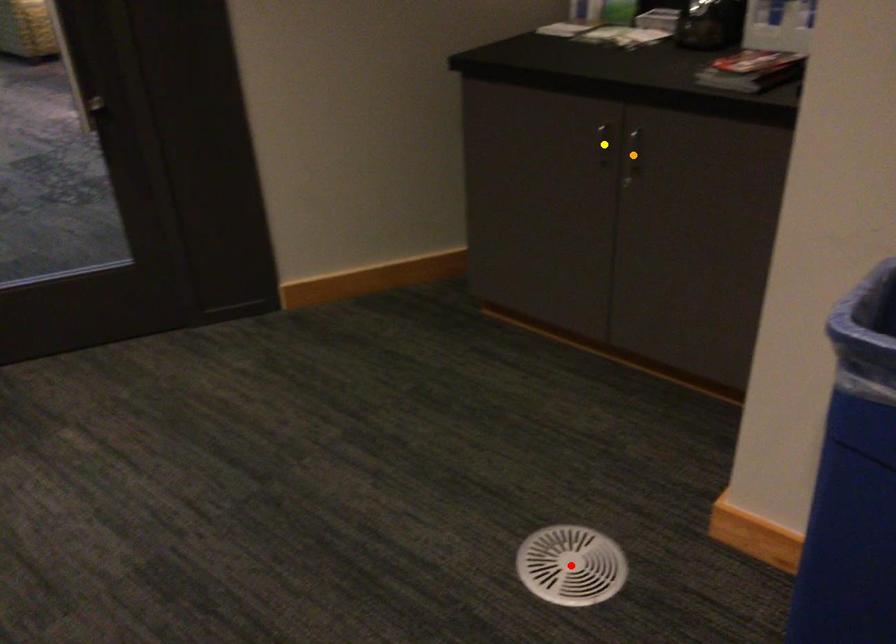
Order these from nearest to farthest:
orange point
red point
yellow point

red point, orange point, yellow point